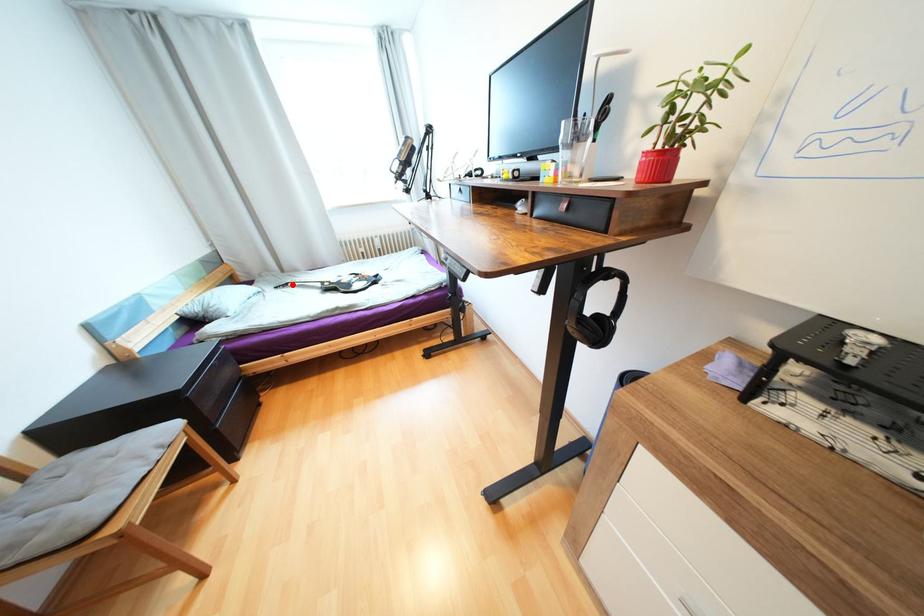
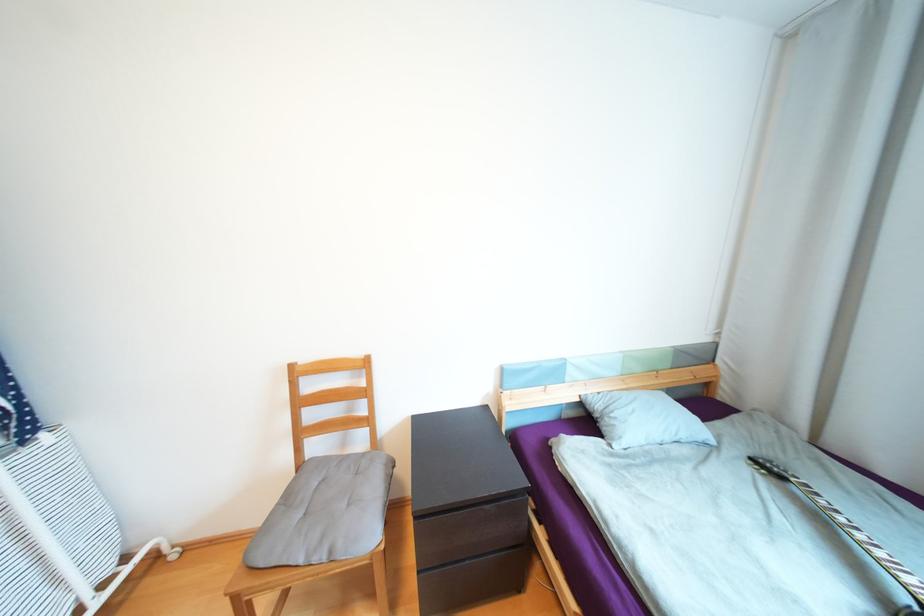
In the second image, find the point that corresponds to the highlighted location in the first image.

(787, 477)